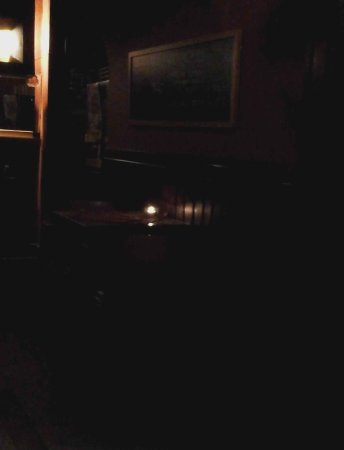
The height and width of the screenshot is (450, 344). I want to click on wall, so click(264, 88).